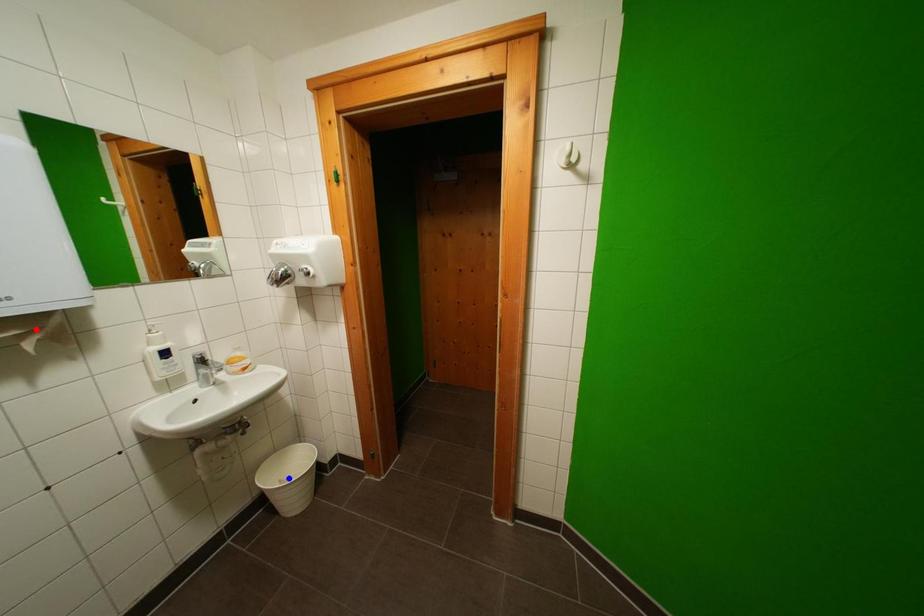
Question: Two points are marked on the image. Which point is closer to the camera?

Choices:
 (A) Blue point is closer.
 (B) Red point is closer.

Answer: (B)